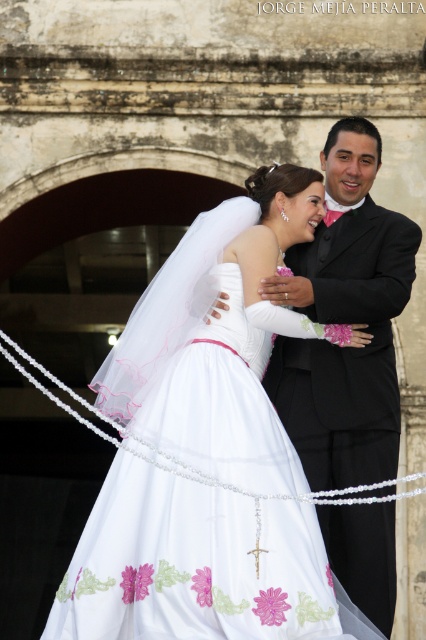
Question: Does white satin dress at center have a lesser width compared to black satin suit at center?

Choices:
 (A) yes
 (B) no

Answer: (B)

Question: Which object is farther from the camera taking this photo?

Choices:
 (A) black satin suit at center
 (B) white satin dress at center

Answer: (A)

Question: Which point is closer to the camera?

Choices:
 (A) (350, 144)
 (B) (268, 611)

Answer: (B)

Question: Can you confirm if white satin dress at center is positioned to the left of black satin suit at center?

Choices:
 (A) yes
 (B) no

Answer: (A)

Question: Is white satin dress at center in front of black satin suit at center?

Choices:
 (A) yes
 (B) no

Answer: (A)